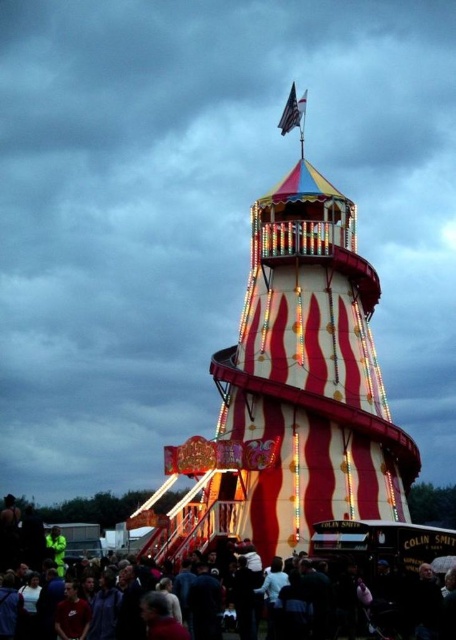
From the picture: Who is positioned more to the left, striped fabric tower at center or dark clothing crowd at lower center?

From the viewer's perspective, striped fabric tower at center appears more on the left side.

Does striped fabric tower at center have a greater height compared to dark clothing crowd at lower center?

Indeed, striped fabric tower at center has a greater height compared to dark clothing crowd at lower center.

What do you see at coordinates (293, 392) in the screenshot? I see `striped fabric tower at center` at bounding box center [293, 392].

Identify the location of striped fabric tower at center. (293, 392).

Which is behind, point (290, 634) or point (301, 116)?

The point (301, 116) is more distant.

Is the position of dark clothing crowd at lower center more distant than that of white fabric flag at top center?

That is False.

Between point (73, 611) and point (293, 113), which one is positioned behind?

The point (293, 113) is more distant.

Identify the location of dark clothing crowd at lower center. (368, 579).

Is the position of striped fabric tower at center less distant than that of white fabric flag at top center?

Yes, it is in front of white fabric flag at top center.

Does striped fabric tower at center have a larger size compared to white fabric flag at top center?

Yes, striped fabric tower at center is bigger than white fabric flag at top center.

At what (x,y) coordinates should I click in order to perform the action: click on striped fabric tower at center. Please return your answer as a coordinate pair (x, y). This screenshot has width=456, height=640. Looking at the image, I should click on click(293, 392).